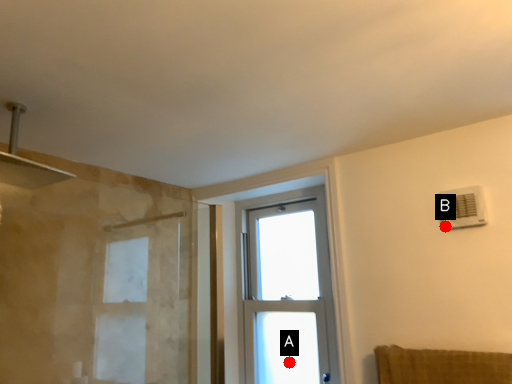
Question: Two points are circled on the image, labeled by A and B beside each circle. Which point is farther to the camera?

Choices:
 (A) A is further
 (B) B is further

Answer: (A)